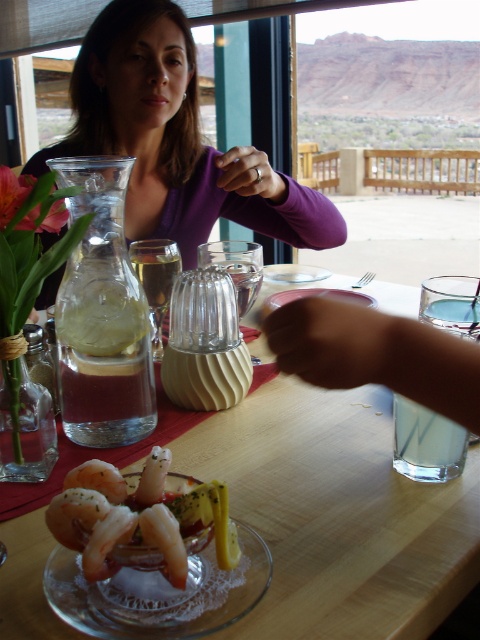
Question: Does clear glass plate at center come behind dark skin smooth hand at center?

Choices:
 (A) yes
 (B) no

Answer: (B)

Question: Where is shiny pink shrimp at center located in relation to dark skin smooth hand at center in the image?

Choices:
 (A) left
 (B) right

Answer: (A)

Question: Which of the following is the closest to the observer?

Choices:
 (A) matte purple shirt at upper center
 (B) clear glass table at center
 (C) clear glass plate at center

Answer: (B)

Question: Which object appears closest to the camera in this image?

Choices:
 (A) purple fabric shirt at upper center
 (B) clear glass plate at center
 (C) clear glass table at center
 (D) matte purple shirt at upper center

Answer: (C)

Question: Which object is positioned farthest from the shiny pink shrimp at center?

Choices:
 (A) purple fabric shirt at upper center
 (B) matte purple shirt at upper center
 (C) dark skin smooth hand at center

Answer: (A)

Question: Is shiny pink shrimp at center further to camera compared to matte purple shirt at upper center?

Choices:
 (A) no
 (B) yes

Answer: (A)